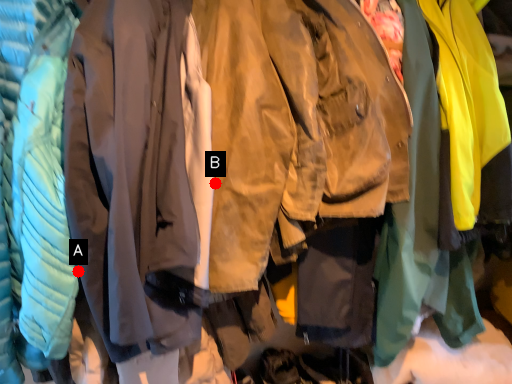
Question: Two points are circled on the image, labeled by A and B beside each circle. Which of the following is the closest to the observer?

Choices:
 (A) A is closer
 (B) B is closer

Answer: (A)